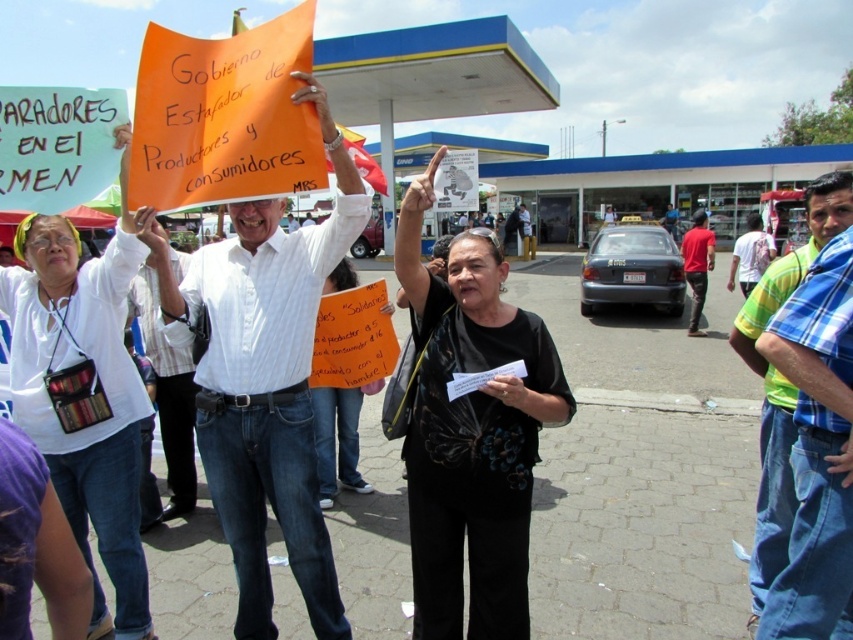
You are a photographer standing in front of the protest scene. You notice two individuals with the white shirt at center and the red cotton shirt at right. Which one is positioned more to the left side of the image?

The white shirt at center is positioned more to the left side of the image than the red cotton shirt at right.

You are a photographer standing at the camera position. You want to take a photo focusing on the point at coordinates point (238, 205) and point (763, 246). Which point will appear larger in the photo?

Point (238, 205) is closer to the camera than point (763, 246), so it will appear larger in the photo.